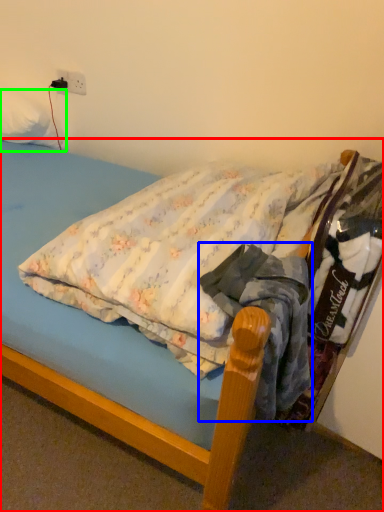
Question: Which is farther away from bed (highlighted by a red box)? clothing (highlighted by a blue box) or pillow (highlighted by a green box)?

Choices:
 (A) clothing
 (B) pillow

Answer: (B)